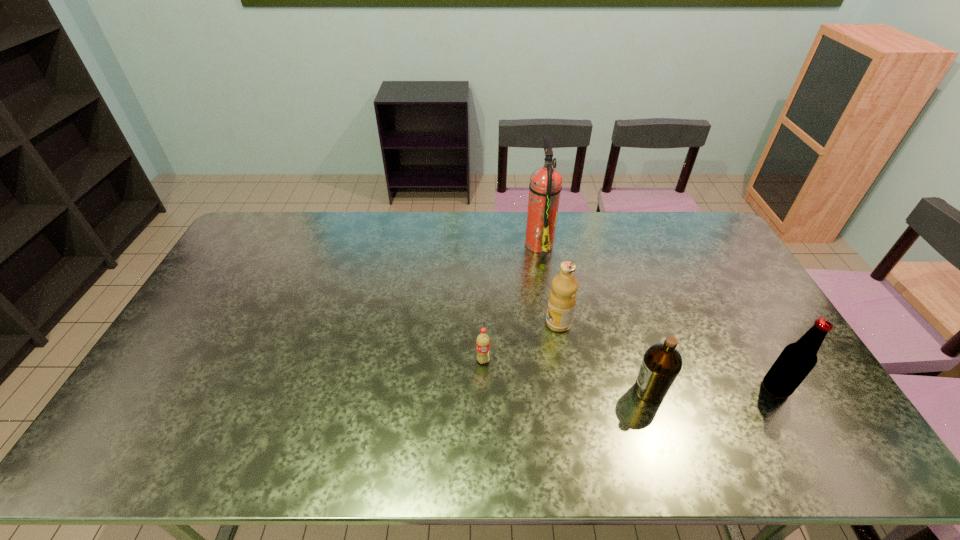
I want to click on vacant space that's between the fire extinguisher and the shortest object, so click(511, 302).

Where is `free area in between the soda and the beer bottle`? Image resolution: width=960 pixels, height=540 pixels. free area in between the soda and the beer bottle is located at coordinates (630, 374).

At what (x,y) coordinates should I click in order to perform the action: click on blank region between the soda and the farthest object. Please return your answer as a coordinate pair (x, y). Looking at the image, I should click on (511, 302).

Identify the location of free point between the second object from right to left and the fire extinguisher. (594, 317).

At what (x,y) coordinates should I click in order to perform the action: click on unoccupied position between the nearer olive oil and the fire extinguisher. Please return your answer as a coordinate pair (x, y). The height and width of the screenshot is (540, 960). Looking at the image, I should click on (594, 317).

Where is `unoccupied position between the rightmost object and the fire extinguisher`? Image resolution: width=960 pixels, height=540 pixels. unoccupied position between the rightmost object and the fire extinguisher is located at coordinates (658, 315).

Identify which object is the third closest to the fourth object from left to right. Please provide its 2D coordinates. Your answer should be formatted as a tuple, i.e. [(x, y)], where the tuple contains the x and y coordinates of a point satisfying the conditions above.

[(483, 340)]

The image size is (960, 540). What are the coordinates of `object that is the third closest to the beer bottle` in the screenshot? It's located at (545, 186).

Locate an element on the screen. This screenshot has height=540, width=960. free space in the image that satisfies the following two spatial constraints: 1. at the nozzle of the farthest object; 2. on the left side of the beer bottle is located at coordinates (562, 388).

This screenshot has height=540, width=960. In order to click on free location that satisfies the following two spatial constraints: 1. on the label of the fourth nearest object; 2. on the back side of the beer bottle in this screenshot , I will do `click(569, 388)`.